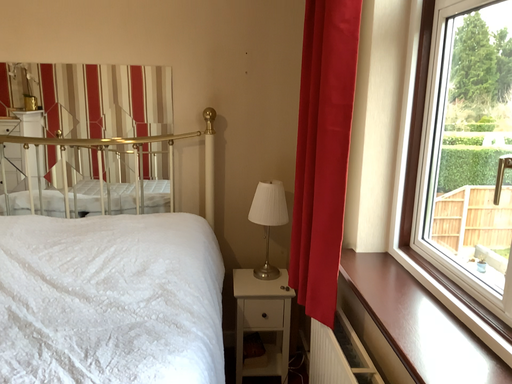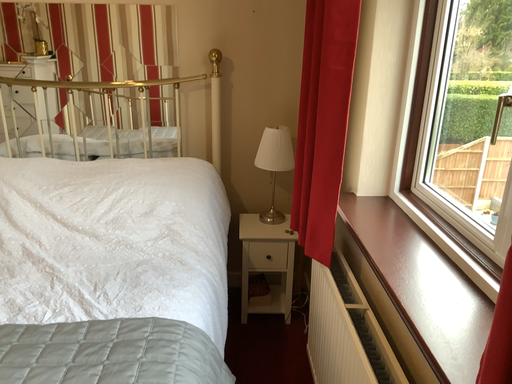
Question: How did the camera likely rotate when shooting the video?

Choices:
 (A) rotated downward
 (B) rotated upward

Answer: (A)